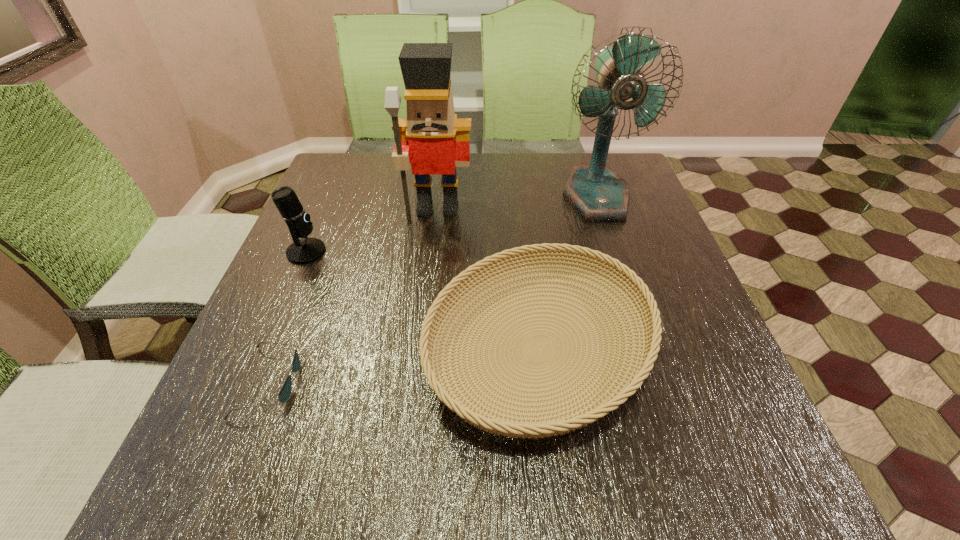
In order to click on free space located on the lenses of the shortest object in this screenshot , I will do `click(336, 382)`.

You are a GUI agent. You are given a task and a screenshot of the screen. Output one action in this format:
    pyautogui.click(x=<x>, y=<y>)
    Task: Click on the fan present at the far edge
    The width and height of the screenshot is (960, 540).
    Given the screenshot: What is the action you would take?
    pyautogui.click(x=598, y=194)

The image size is (960, 540). I want to click on nutcracker that is positioned at the far edge, so click(x=432, y=139).

Find the location of a particular element. The image size is (960, 540). object present at the near edge is located at coordinates (463, 403).

What are the coordinates of `microphone at the left edge` in the screenshot? It's located at (306, 250).

I want to click on sunglasses at the left edge, so pyautogui.click(x=284, y=394).

The height and width of the screenshot is (540, 960). Identify the location of fan that is at the right edge. (598, 194).

Find the location of a particular element. This screenshot has width=960, height=540. basket present at the right edge is located at coordinates (463, 403).

Locate an element on the screen. This screenshot has width=960, height=540. object located at the far right corner is located at coordinates (598, 194).

Where is `object present at the near right corner`? The height and width of the screenshot is (540, 960). object present at the near right corner is located at coordinates (463, 403).